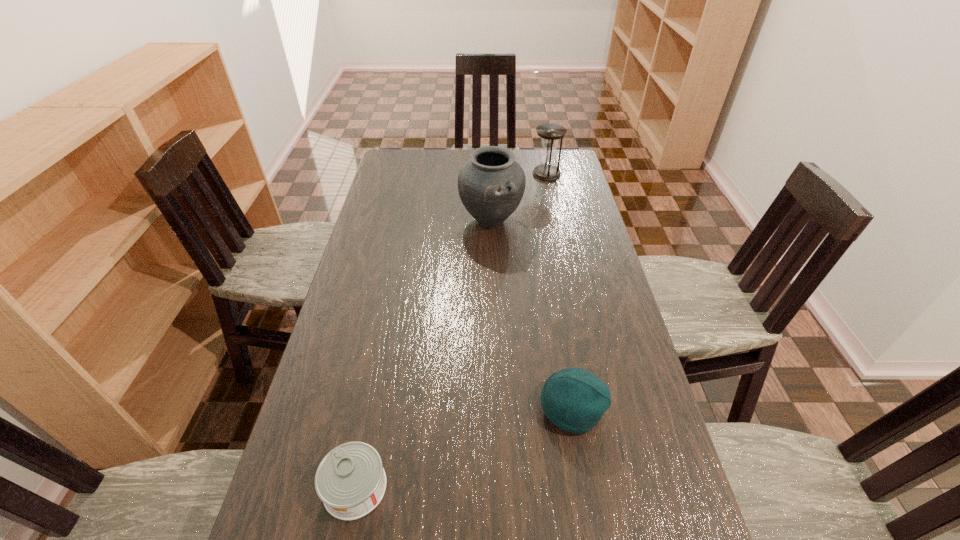
Find the location of a particular element. free area in between the third farthest object and the hourglass is located at coordinates (559, 291).

The width and height of the screenshot is (960, 540). What are the coordinates of `free area in between the urn and the can` in the screenshot? It's located at (423, 354).

The width and height of the screenshot is (960, 540). In order to click on vacant area that lies between the beanie and the second tallest object in this screenshot , I will do `click(559, 291)`.

Where is `free space between the hourglass and the shortest object`? Image resolution: width=960 pixels, height=540 pixels. free space between the hourglass and the shortest object is located at coordinates (451, 330).

You are a GUI agent. You are given a task and a screenshot of the screen. Output one action in this format:
    pyautogui.click(x=<x>, y=<y>)
    Task: Click on the empty space that is in between the second nearest object and the nearest object
    
    Given the screenshot: What is the action you would take?
    pyautogui.click(x=463, y=448)

The width and height of the screenshot is (960, 540). Identify the location of vacant area between the nearest object and the tallest object. (423, 354).

Where is `unoccupied position between the second tallest object and the shortest object`? unoccupied position between the second tallest object and the shortest object is located at coordinates (451, 330).

I want to click on blank region between the second nearest object and the farthest object, so click(559, 291).

The width and height of the screenshot is (960, 540). What are the coordinates of `object that is the closest to the third nearest object` in the screenshot? It's located at (550, 134).

Identify which object is the closest to the second farthest object. Please provide its 2D coordinates. Your answer should be formatted as a tuple, i.e. [(x, y)], where the tuple contains the x and y coordinates of a point satisfying the conditions above.

[(550, 134)]